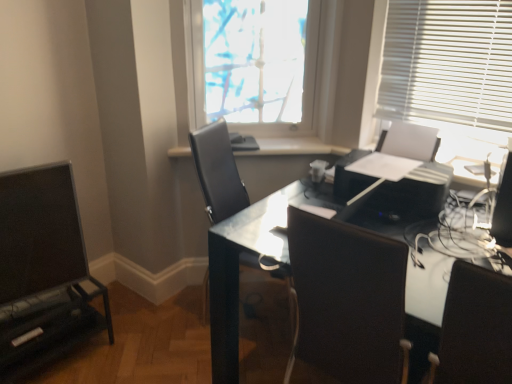
Where is `white glossy window sill at center`? This screenshot has width=512, height=384. white glossy window sill at center is located at coordinates [292, 147].

Describe the element at coordinates (238, 263) in the screenshot. I see `glossy black desk at center` at that location.

The width and height of the screenshot is (512, 384). Describe the element at coordinates (313, 77) in the screenshot. I see `translucent fabric at upper center` at that location.

Find the location of `black leather chair at right, the 2th chair from the back`. black leather chair at right, the 2th chair from the back is located at coordinates click(x=475, y=329).

Measure the distance between black leather chair at center, the second chair viewed from the front, and camera.

A distance of 6.24 feet exists between black leather chair at center, the second chair viewed from the front, and camera.

The image size is (512, 384). What do you see at coordinates (399, 178) in the screenshot? I see `black plastic printer at center` at bounding box center [399, 178].

Identify the location of white glossy window sill at center. The width and height of the screenshot is (512, 384). (292, 147).

Which point is more forward, (406,150) or (301,144)?

The point (406,150) is in front.

Between black plastic printer at center and white glossy window sill at center, which one has less height?

Standing shorter between the two is white glossy window sill at center.

Between black plastic printer at center and white glossy window sill at center, which one appears on the right side from the viewer's perspective?

black plastic printer at center is more to the right.

Is black plastic printer at center looking in the opposite direction of white glossy window sill at center?

No, black plastic printer at center's orientation is not away from white glossy window sill at center.

Considering the positions of objects glossy black desk at center and matte black entertainment center at left in the image provided, who is in front, glossy black desk at center or matte black entertainment center at left?

glossy black desk at center is closer to the camera.

Is glossy black desk at center facing towards matte black entertainment center at left?

No, glossy black desk at center is not facing towards matte black entertainment center at left.

Considering the relative sizes of glossy black desk at center and matte black entertainment center at left in the image provided, is glossy black desk at center bigger than matte black entertainment center at left?

Yes.

Where is `entertainment center below the glossy black desk at center (from a real-world perspective)`? entertainment center below the glossy black desk at center (from a real-world perspective) is located at coordinates (52, 331).

From the picture: Is matte black monitor at left turned away from white glossy window sill at center?

No.

Is point (30, 272) closer or farther from the camera than point (325, 150)?

Point (30, 272) is positioned closer to the camera compared to point (325, 150).

Does matte black monitor at left appear on the left side of white glossy window sill at center?

Correct, you'll find matte black monitor at left to the left of white glossy window sill at center.

How far apart are matte black monitor at left and white glossy window sill at center?

matte black monitor at left and white glossy window sill at center are 3.37 feet apart.

From their relative heights in the image, would you say translucent fabric at upper center is taller or shorter than white glossy window sill at center?

Clearly, translucent fabric at upper center is taller compared to white glossy window sill at center.

From the picture: Does translucent fabric at upper center have a larger size compared to white glossy window sill at center?

Yes, translucent fabric at upper center is bigger than white glossy window sill at center.

Is translucent fabric at upper center facing towards white glossy window sill at center?

No, translucent fabric at upper center is not turned towards white glossy window sill at center.

Locate an element on the screen. Image resolution: width=512 pixels, height=384 pixels. window above the white glossy window sill at center (from a real-world perspective) is located at coordinates (313, 77).

Can you confirm if matte black entertainment center at left is wider than translucent fabric at upper center?

Indeed, matte black entertainment center at left has a greater width compared to translucent fabric at upper center.

From the image's perspective, which one is positioned higher, matte black entertainment center at left or translucent fabric at upper center?

translucent fabric at upper center appears higher in the image.

From a real-world perspective, which object rests below the other?

From a 3D spatial view, matte black entertainment center at left is below.

Between matte black entertainment center at left and translucent fabric at upper center, which one appears on the left side from the viewer's perspective?

Positioned to the left is matte black entertainment center at left.

Considering the relative positions of matte black monitor at left and black leather chair at right, the 1th chair viewed from the right, in the image provided, is matte black monitor at left to the left of black leather chair at right, the 1th chair viewed from the right, from the viewer's perspective?

Yes, matte black monitor at left is to the left of black leather chair at right, the 1th chair viewed from the right.

Is matte black monitor at left bigger or smaller than black leather chair at right, positioned as the 2th chair in left-to-right order?

Clearly, matte black monitor at left is smaller in size than black leather chair at right, positioned as the 2th chair in left-to-right order.

Is matte black monitor at left looking in the opposite direction of black leather chair at right, the first chair when ordered from front to back?

No, matte black monitor at left is not facing the opposite direction of black leather chair at right, the first chair when ordered from front to back.

Are white glossy window sill at center and black plastic printer at center beside each other?

No, white glossy window sill at center is not with black plastic printer at center.

Considering the relative sizes of white glossy window sill at center and black plastic printer at center in the image provided, is white glossy window sill at center bigger than black plastic printer at center?

Incorrect, white glossy window sill at center is not larger than black plastic printer at center.

From a real-world perspective, is white glossy window sill at center under black plastic printer at center?

Yes, from a real-world perspective, white glossy window sill at center is beneath black plastic printer at center.

Is white glossy window sill at center oriented towards black plastic printer at center?

No, white glossy window sill at center is not turned towards black plastic printer at center.

At what (x,y) coordinates should I click in order to perform the action: click on window sill behind the black plastic printer at center. Please return your answer as a coordinate pair (x, y). Looking at the image, I should click on (292, 147).

This screenshot has width=512, height=384. I want to click on desk in front of the matte black entertainment center at left, so click(x=238, y=263).

Estimate the real-world distances between objects in this image. Which object is further from matte black entertainment center at left, black leather chair at center, positioned as the first chair in back-to-front order, or black leather chair at right, the 1th chair viewed from the right?

Among the two, black leather chair at right, the 1th chair viewed from the right, is located further to matte black entertainment center at left.

When comparing their distances from translucent fabric at upper center, does glossy black desk at center or white glossy window sill at center seem further?

glossy black desk at center is further to translucent fabric at upper center.

From the image, which object appears to be nearer to translucent fabric at upper center, black leather chair at right, the 2th chair from the back, or black leather chair at center, the second chair viewed from the front?

black leather chair at center, the second chair viewed from the front, is positioned closer to the anchor translucent fabric at upper center.

When comparing their distances from white glossy window sill at center, does glossy black desk at center or black plastic printer at center seem further?

glossy black desk at center.

Estimate the real-world distances between objects in this image. Which object is closer to white glossy window sill at center, black plastic printer at center or black leather chair at right, the 1th chair viewed from the right?

black plastic printer at center is positioned closer to the anchor white glossy window sill at center.

Looking at this image, when comparing their distances from black leather chair at right, positioned as the 2th chair in left-to-right order, does white glossy window sill at center or matte black entertainment center at left seem further?

Among the two, matte black entertainment center at left is located further to black leather chair at right, positioned as the 2th chair in left-to-right order.

Estimate the real-world distances between objects in this image. Which object is further from black plastic printer at center, matte black monitor at left or translucent fabric at upper center?

matte black monitor at left is positioned further to the anchor black plastic printer at center.

Based on their spatial positions, is black leather chair at center, the second chair viewed from the front, or black leather chair at right, the 1th chair viewed from the right, further from white glossy window sill at center?

The object further to white glossy window sill at center is black leather chair at right, the 1th chair viewed from the right.

The image size is (512, 384). Find the location of `desk between black leather chair at center, positioned as the first chair in back-to-front order, and black plastic printer at center from left to right`. desk between black leather chair at center, positioned as the first chair in back-to-front order, and black plastic printer at center from left to right is located at coordinates (238, 263).

The width and height of the screenshot is (512, 384). In order to click on desk located between matte black entertainment center at left and black leather chair at right, the 1th chair viewed from the right, in the left-right direction in this screenshot , I will do `click(238, 263)`.

This screenshot has height=384, width=512. Find the location of `printer between black leather chair at right, positioned as the 2th chair in left-to-right order, and white glossy window sill at center in the front-back direction`. printer between black leather chair at right, positioned as the 2th chair in left-to-right order, and white glossy window sill at center in the front-back direction is located at coordinates (399, 178).

This screenshot has width=512, height=384. In order to click on screen between matte black entertainment center at left and black plastic printer at center in this screenshot , I will do `click(39, 232)`.